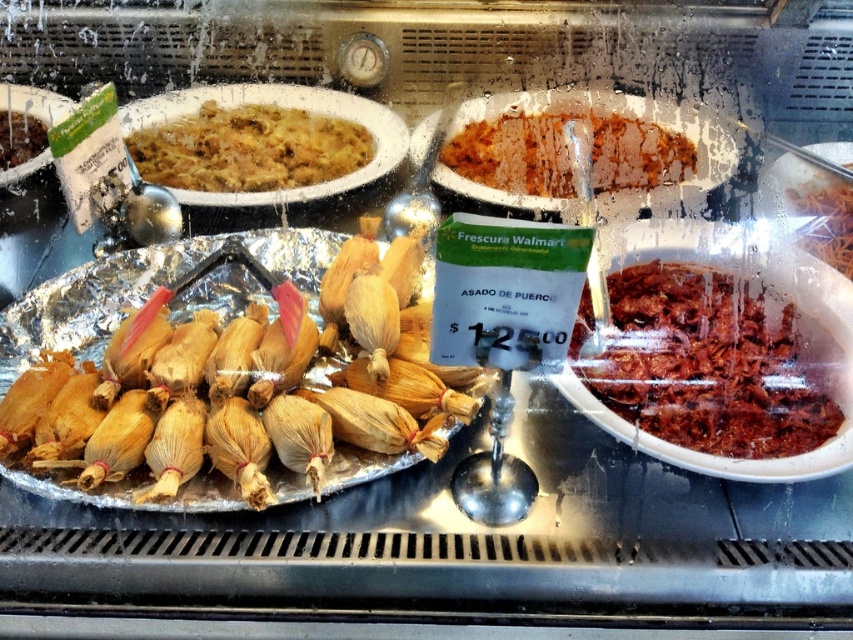
Between point (550, 188) and point (3, 116), which one is positioned behind?

The point (3, 116) is more distant.

Is point (630, 188) more distant than point (28, 129)?

No, (630, 188) is closer to viewer.

Locate an element on the screen. brown crumbly rice at upper center is located at coordinates (567, 154).

Does yellowish matte rice at upper left come in front of brown shredded meat at right?

No, it is not.

Can you confirm if yellowish matte rice at upper left is wider than brown shredded meat at right?

Indeed, yellowish matte rice at upper left has a greater width compared to brown shredded meat at right.

What do you see at coordinates (248, 148) in the screenshot?
I see `yellowish matte rice at upper left` at bounding box center [248, 148].

Where is `yellowish matte rice at upper left`? The height and width of the screenshot is (640, 853). yellowish matte rice at upper left is located at coordinates (248, 148).

Between dark red shredded meat at right and brown shredded meat at right, which one is positioned lower?

dark red shredded meat at right is lower down.

Looking at this image, does dark red shredded meat at right appear on the right side of brown shredded meat at right?

A: In fact, dark red shredded meat at right is to the left of brown shredded meat at right.

Locate an element on the screen. dark red shredded meat at right is located at coordinates click(x=706, y=364).